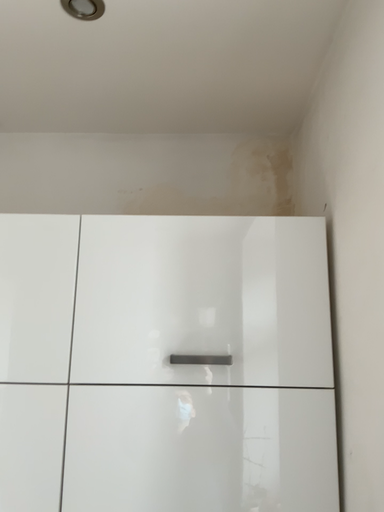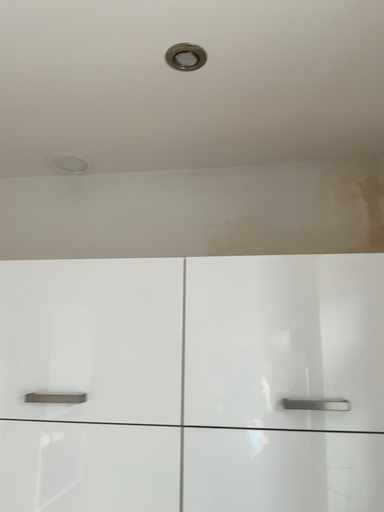
Question: Which way did the camera rotate in the video?

Choices:
 (A) rotated left
 (B) rotated right

Answer: (A)